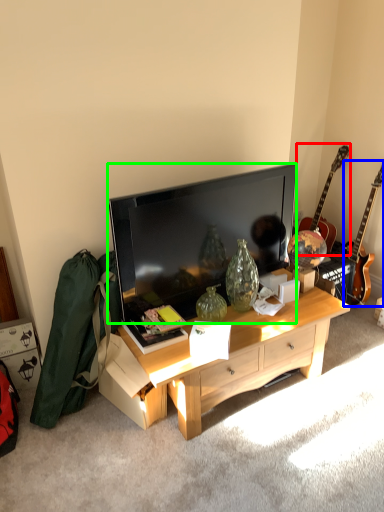
Question: Estimate the real-world distances between objects in this image. Which object is farther from guitar (highlighted by a red box), guitar (highlighted by a blue box) or television (highlighted by a green box)?

Choices:
 (A) guitar
 (B) television

Answer: (B)